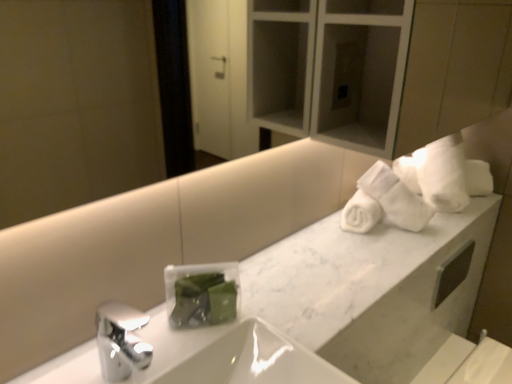
Question: Can you confirm if white marble counter at upper right is bigger than white glossy sink at center?

Choices:
 (A) yes
 (B) no

Answer: (B)

Question: Does white marble counter at upper right come behind white glossy sink at center?

Choices:
 (A) no
 (B) yes

Answer: (B)

Question: Can you confirm if white marble counter at upper right is shorter than white glossy sink at center?

Choices:
 (A) no
 (B) yes

Answer: (B)

Question: Is white marble counter at upper right thinner than white glossy sink at center?

Choices:
 (A) no
 (B) yes

Answer: (B)

Question: Can you see white marble counter at upper right touching white glossy sink at center?

Choices:
 (A) no
 (B) yes

Answer: (A)

Question: From the image's perspective, is white marble counter at upper right over white glossy sink at center?

Choices:
 (A) no
 (B) yes

Answer: (B)

Question: From a real-world perspective, is white soft towels at upper right positioned under white glossy sink at center based on gravity?

Choices:
 (A) yes
 (B) no

Answer: (B)

Question: Would you consider white soft towels at upper right to be distant from white glossy sink at center?

Choices:
 (A) yes
 (B) no

Answer: (B)

Question: Is white glossy sink at center completely or partially inside white soft towels at upper right?

Choices:
 (A) yes
 (B) no

Answer: (B)

Question: From the image's perspective, is white soft towels at upper right located above white glossy sink at center?

Choices:
 (A) yes
 (B) no

Answer: (A)

Question: Would you say white soft towels at upper right is outside white glossy sink at center?

Choices:
 (A) no
 (B) yes

Answer: (B)

Question: Is white soft towels at upper right bigger than white glossy sink at center?

Choices:
 (A) no
 (B) yes

Answer: (A)

Question: Is white marble counter at upper right inside white glossy sink at center?

Choices:
 (A) yes
 (B) no

Answer: (A)